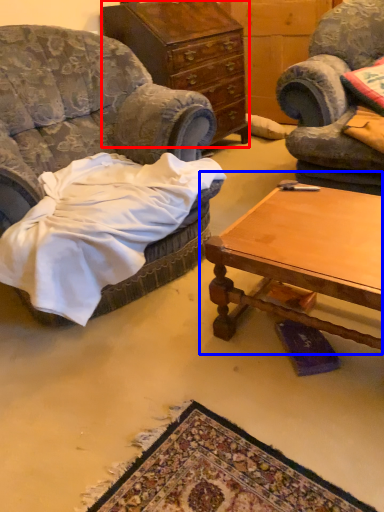
Question: Which object is further to the camera taking this photo, cabinetry (highlighted by a red box) or coffee table (highlighted by a blue box)?

Choices:
 (A) cabinetry
 (B) coffee table

Answer: (A)